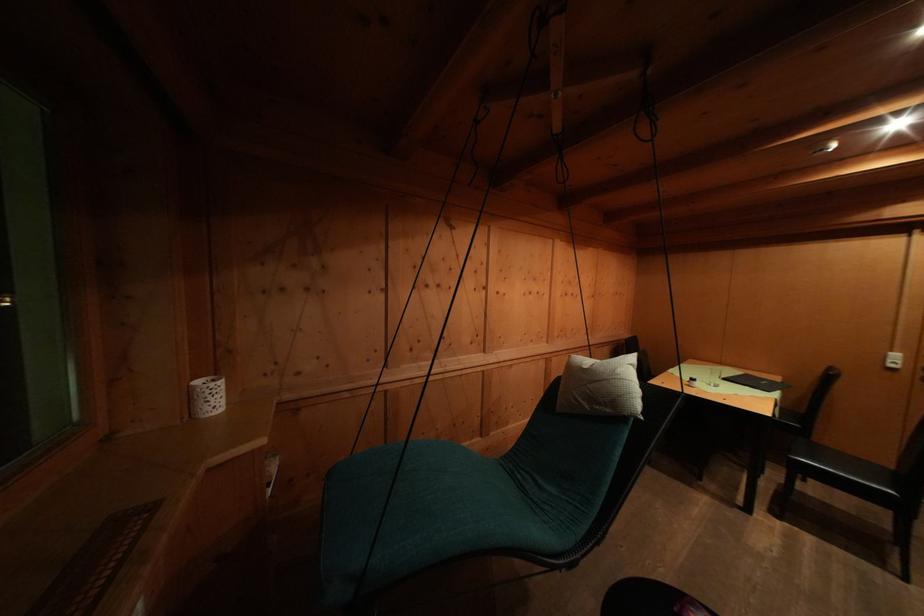
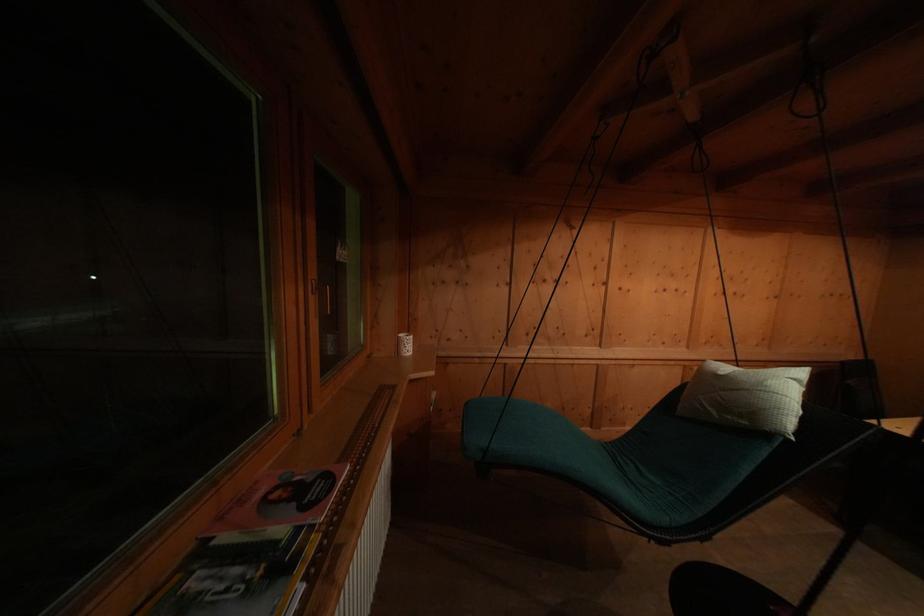
Question: The camera is either moving clockwise (left) or counter-clockwise (right) around the object. The first image is from the beginning of the video and the second image is from the end. Is the camera moving left or right when shooting the video?

Choices:
 (A) Left
 (B) Right

Answer: (B)